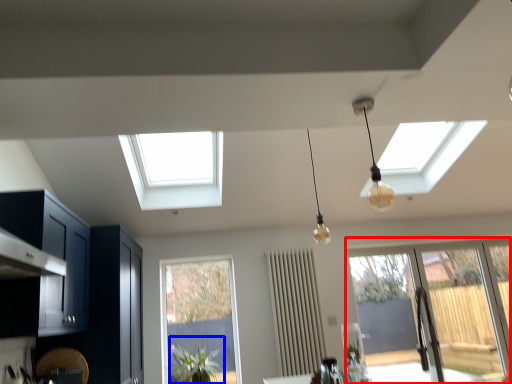
Question: Among these objects, which one is farthest to the camera, window (highlighted by a red box) or plant (highlighted by a blue box)?

Choices:
 (A) window
 (B) plant

Answer: (A)